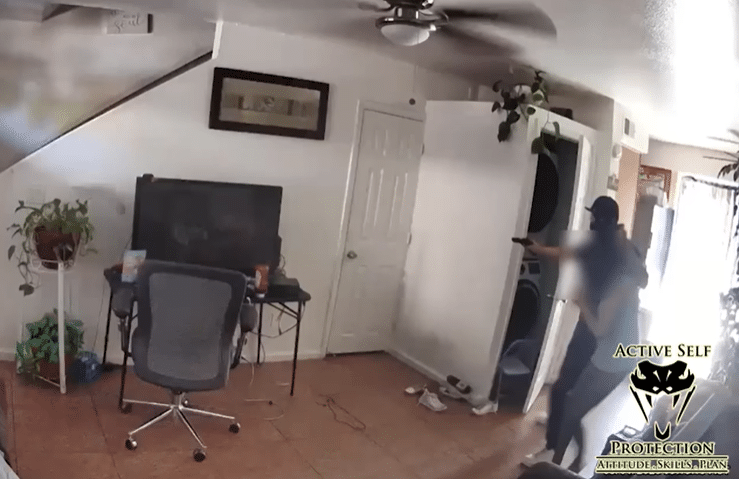
At what (x,y) coordinates should I click in order to perform the action: click on door. Please return your answer as a coordinate pair (x, y). The image size is (739, 479). Looking at the image, I should click on (585, 190), (364, 228).